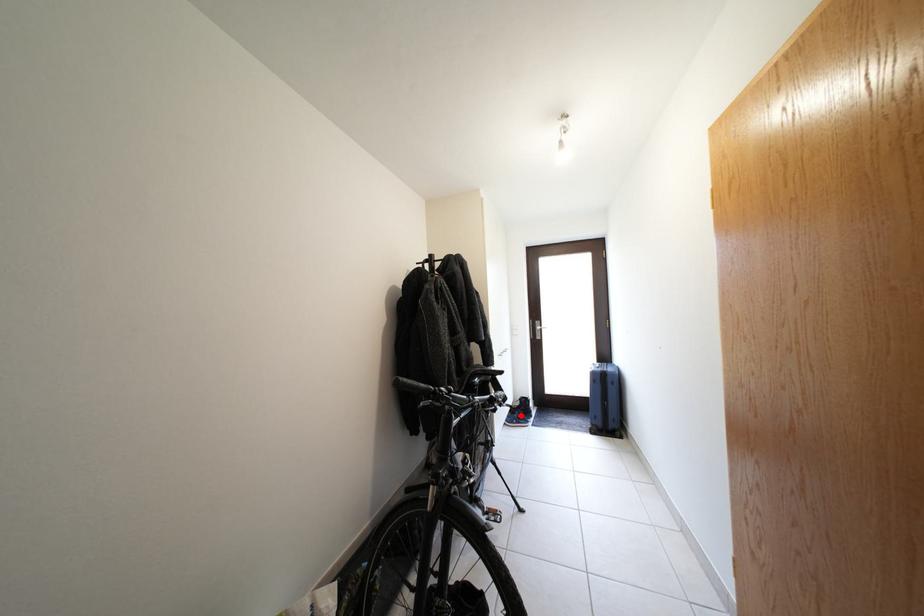
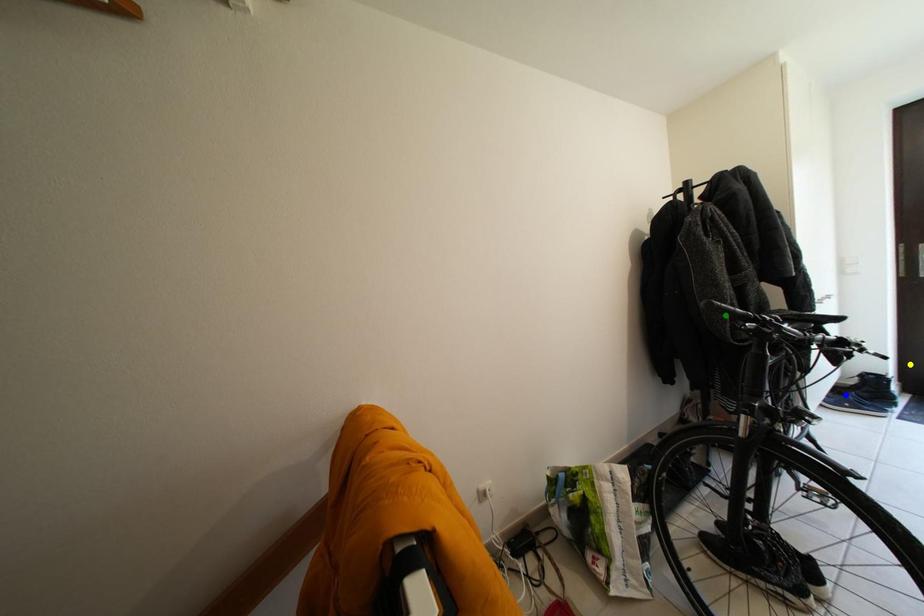
Question: I am providing you with two images of the same scene from different viewpoints. A red point is marked on the first image. You are given multiple points on the second image. Which point in image 2 is actually the same real-world point as the red point in image 1?

Choices:
 (A) yellow point
 (B) blue point
 (C) green point

Answer: (B)